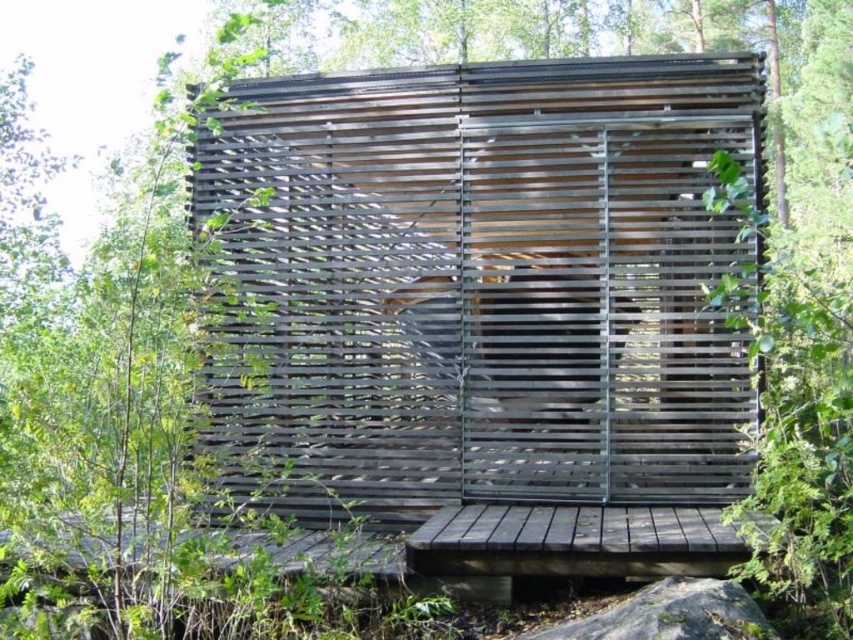
Question: Is wooden slats at center in front of gray rough rock at lower center?

Choices:
 (A) yes
 (B) no

Answer: (B)

Question: Can you confirm if wooden slats at center is positioned above gray rough rock at lower center?

Choices:
 (A) no
 (B) yes

Answer: (B)

Question: Does wooden slats at center come in front of gray rough rock at lower center?

Choices:
 (A) no
 (B) yes

Answer: (A)

Question: Which object is closer to the camera taking this photo?

Choices:
 (A) wooden slats at center
 (B) gray rough rock at lower center

Answer: (B)